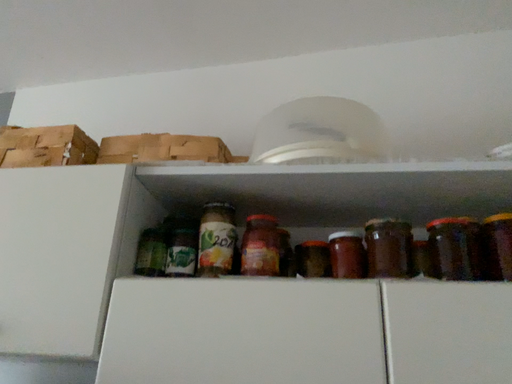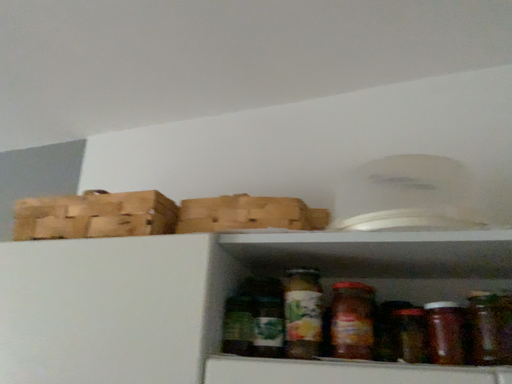
Question: How did the camera likely rotate when shooting the video?

Choices:
 (A) rotated right
 (B) rotated left

Answer: (B)